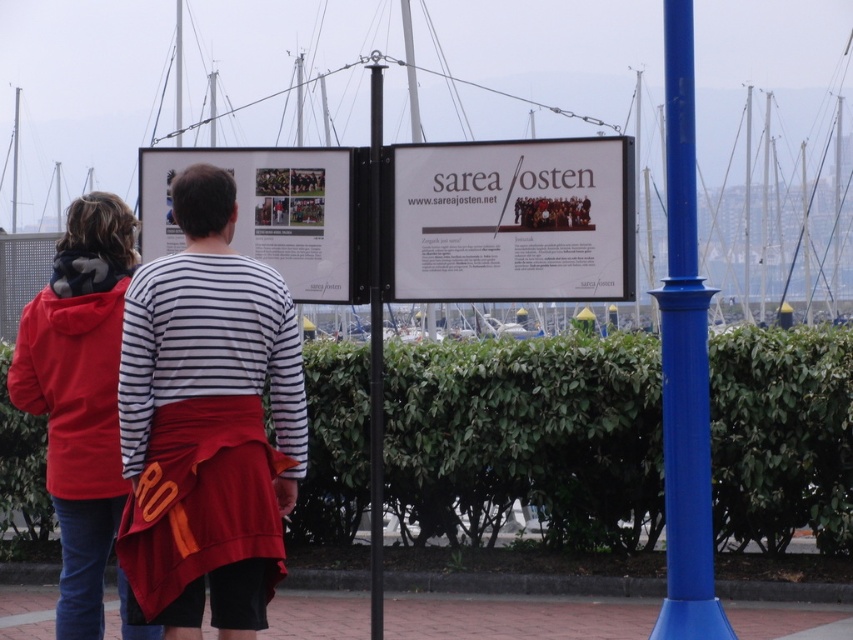
You are a photographer trying to capture both the matte striped shirt at center and the white paper signage at center in one frame. Based on their sizes, which object should you focus on first to ensure both are clearly visible in the photo?

The matte striped shirt at center has a smaller size compared to white paper signage at center, so you should focus on the matte striped shirt at center first to ensure its details are clear while still capturing the larger white paper signage at center in the frame.

You are a delivery person who needs to attach a package to the black metal pole at center. However, there is already a white glossy signboard at center on top of it. Can you place the package on the pole without covering the signboard?

The white glossy signboard at center is located above the black metal pole at center, so you can place the package below the signboard on the pole without covering it.

You are a photographer trying to capture both the matte striped shirt at center and the white paper signage at center in a single frame. Based on their sizes, which object should you focus on first to ensure both fit in the frame?

Since the matte striped shirt at center is thinner than the white paper signage at center, you should focus on positioning the wider white paper signage at center first to ensure it fits properly in the frame, then adjust to include the thinner matte striped shirt at center.